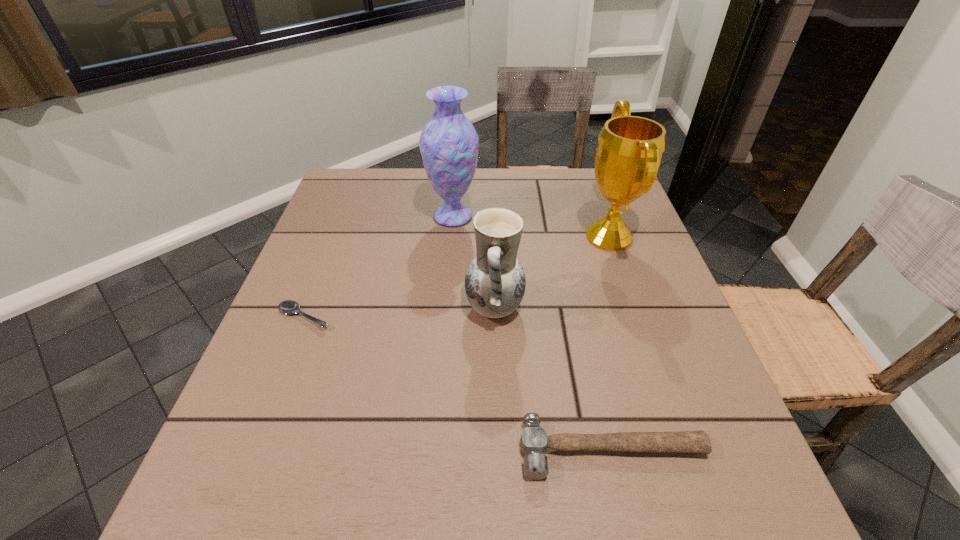
Where is `vase`? vase is located at coordinates (449, 144).

The width and height of the screenshot is (960, 540). I want to click on award, so click(x=630, y=149).

The image size is (960, 540). What are the coordinates of `pottery` in the screenshot? It's located at (495, 282).

This screenshot has height=540, width=960. I want to click on hammer, so click(534, 441).

Where is `the nearest object`? The image size is (960, 540). the nearest object is located at coordinates (534, 441).

The width and height of the screenshot is (960, 540). I want to click on soupspoon, so click(288, 307).

The width and height of the screenshot is (960, 540). I want to click on the leftmost object, so click(x=288, y=307).

At what (x,y) coordinates should I click in order to perform the action: click on vacant area located on the front of the vase. Please return your answer as a coordinate pair (x, y). The image size is (960, 540). Looking at the image, I should click on (445, 319).

You are a GUI agent. You are given a task and a screenshot of the screen. Output one action in this format:
    pyautogui.click(x=<x>, y=<y>)
    Task: Click on the vacant area situated 0.250m on the front-facing side of the award
    The image size is (960, 540).
    Given the screenshot: What is the action you would take?
    pyautogui.click(x=479, y=237)

Find the location of a particular element. This screenshot has height=540, width=960. vacant space located on the front-facing side of the award is located at coordinates (488, 237).